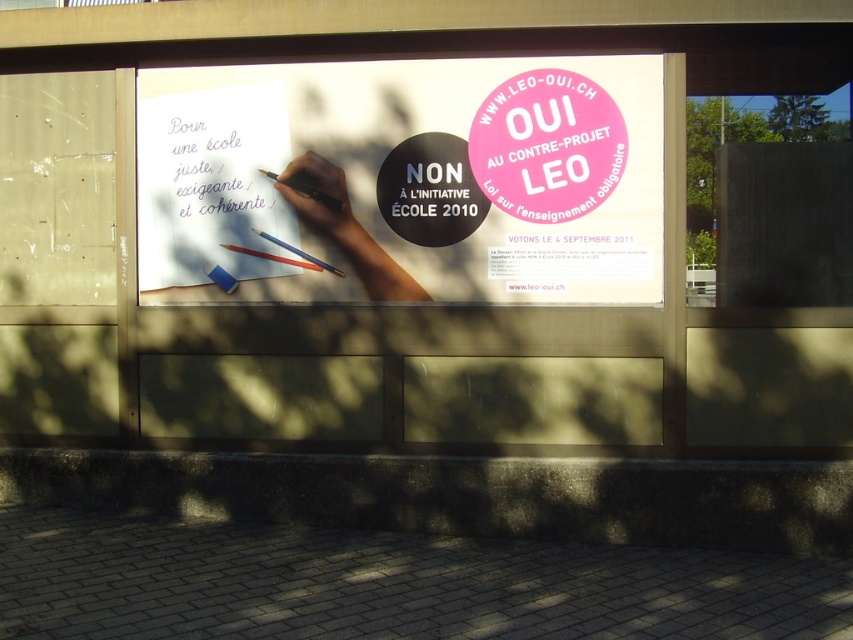
Question: Which point appears closest to the camera in this image?

Choices:
 (A) (386, 192)
 (B) (306, 186)
 (C) (225, 248)
 (D) (264, 236)

Answer: (A)

Question: Which point is farther from the camera taking this photo?

Choices:
 (A) (194, 180)
 (B) (282, 243)

Answer: (A)

Question: Can you confirm if white paper at upper left is positioned to the left of black plastic pen at upper left?

Choices:
 (A) yes
 (B) no

Answer: (A)

Question: Is white paper at upper left to the right of black plastic pen at upper left from the viewer's perspective?

Choices:
 (A) no
 (B) yes

Answer: (A)

Question: Which of these objects is positioned closest to the matte red pen at center?

Choices:
 (A) blue plastic pen at center
 (B) black plastic pen at upper left
 (C) smooth skin hand at center
 (D) white paper at center

Answer: (A)

Question: Is matte red pen at center wider than blue plastic pen at center?

Choices:
 (A) no
 (B) yes

Answer: (B)